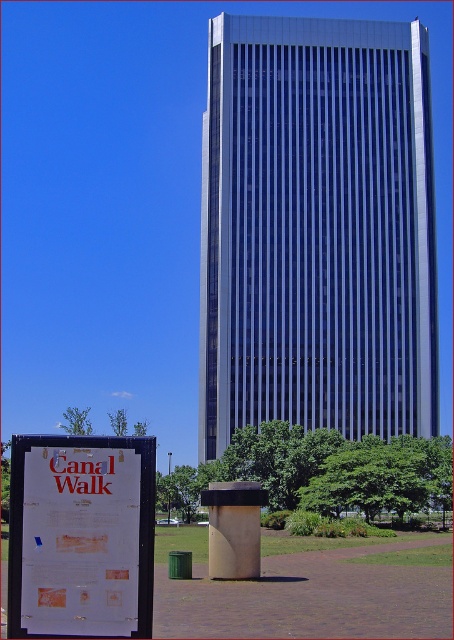
Does point (326, 284) come closer to viewer compared to point (83, 432)?

Yes, point (326, 284) is in front of point (83, 432).

You are a GUI agent. You are given a task and a screenshot of the screen. Output one action in this format:
    pyautogui.click(x=<x>, y=<y>)
    Task: Click on the silver glass skyscraper at center
    The image size is (454, 640).
    Given the screenshot: What is the action you would take?
    pyautogui.click(x=317, y=228)

Does silver glass skyscraper at center have a lesser width compared to white paper sign at lower left?

Incorrect, silver glass skyscraper at center's width is not less than white paper sign at lower left's.

Who is more distant from viewer, (295,308) or (9,524)?

Positioned behind is point (295,308).

At what (x,y) coordinates should I click in order to perform the action: click on silver glass skyscraper at center. Please return your answer as a coordinate pair (x, y). This screenshot has height=640, width=454. Looking at the image, I should click on (317, 228).

Where is `silver glass skyscraper at center`? The image size is (454, 640). silver glass skyscraper at center is located at coordinates (317, 228).

In the scene shown: Between white paper sign at lower left and green leafy tree at lower left, which one has less height?

white paper sign at lower left is shorter.

Is point (70, 598) positioned before point (84, 426)?

Yes, it is.

At what (x,y) coordinates should I click in order to perform the action: click on white paper sign at lower left. Please return your answer as a coordinate pair (x, y). The width and height of the screenshot is (454, 640). Looking at the image, I should click on (80, 536).